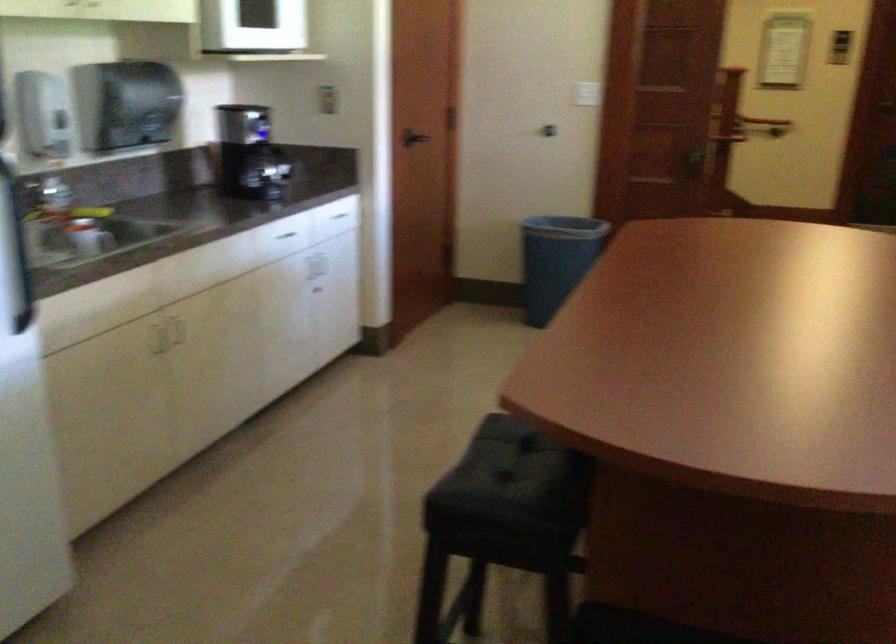
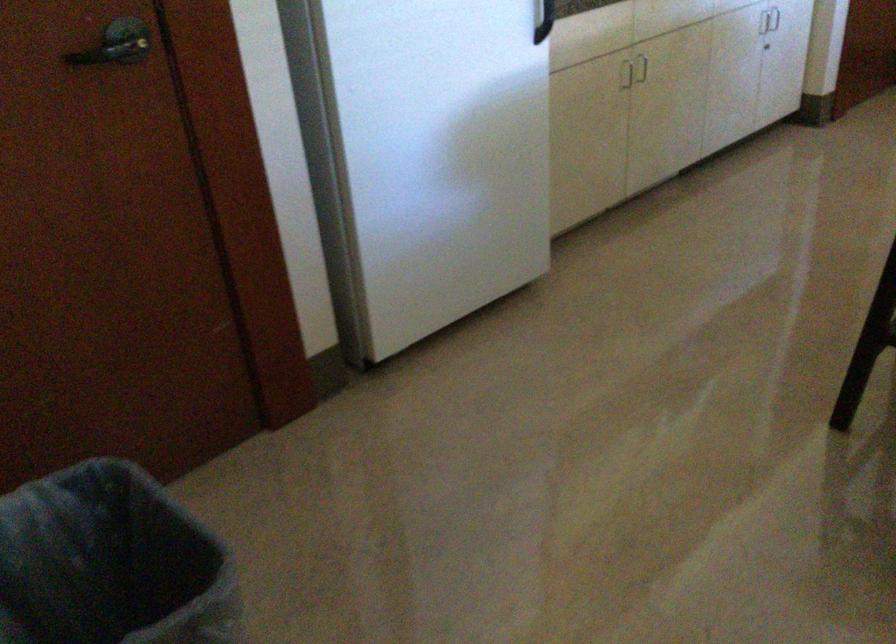
In the second image, find the point that corresponds to pixel 158 333 in the first image.

(642, 69)